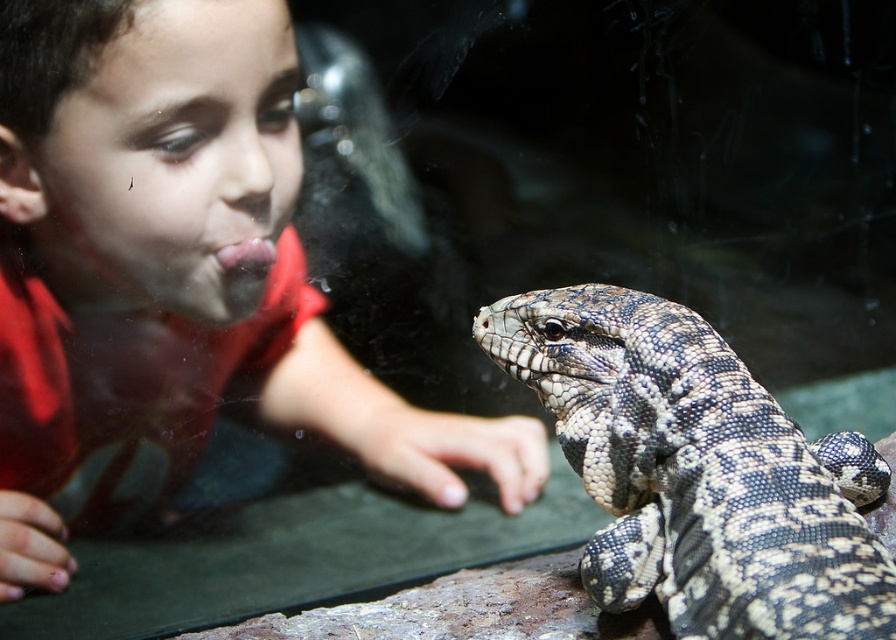
Is point (179, 260) closer to camera compared to point (714, 481)?

No, (179, 260) is behind (714, 481).

Is matte red shirt at upper left taller than speckled scaly lizard at center?

Indeed, matte red shirt at upper left has a greater height compared to speckled scaly lizard at center.

Find the location of a particular element. The width and height of the screenshot is (896, 640). matte red shirt at upper left is located at coordinates (177, 275).